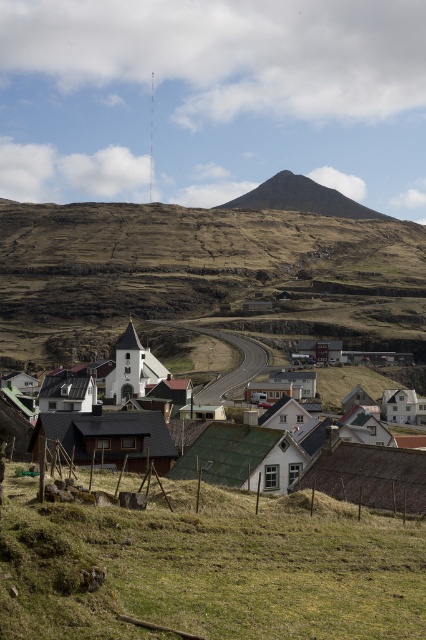
Question: Among these points, which one is farthest from the camera?

Choices:
 (A) (218, 276)
 (B) (276, 195)

Answer: (B)

Question: Is green grassy hillside at lower center to the left of green corrugated metal roofs at center from the viewer's perspective?

Choices:
 (A) yes
 (B) no

Answer: (B)

Question: Estimate the real-world distances between objects in this image. Which object is closer to the brown rocky mountain at upper center?

Choices:
 (A) green grassy hillside at lower center
 (B) green corrugated metal roofs at center
 (C) brown grassy hillside at center

Answer: (C)

Question: Which of the following is the farthest from the observer?

Choices:
 (A) green corrugated metal roofs at center
 (B) green grassy hillside at lower center
 (C) brown grassy hillside at center
 (D) brown rocky mountain at upper center

Answer: (D)

Question: Can you confirm if brown grassy hillside at center is positioned to the left of brown rocky mountain at upper center?

Choices:
 (A) yes
 (B) no

Answer: (A)

Question: Can you confirm if brown grassy hillside at center is thinner than brown rocky mountain at upper center?

Choices:
 (A) yes
 (B) no

Answer: (B)